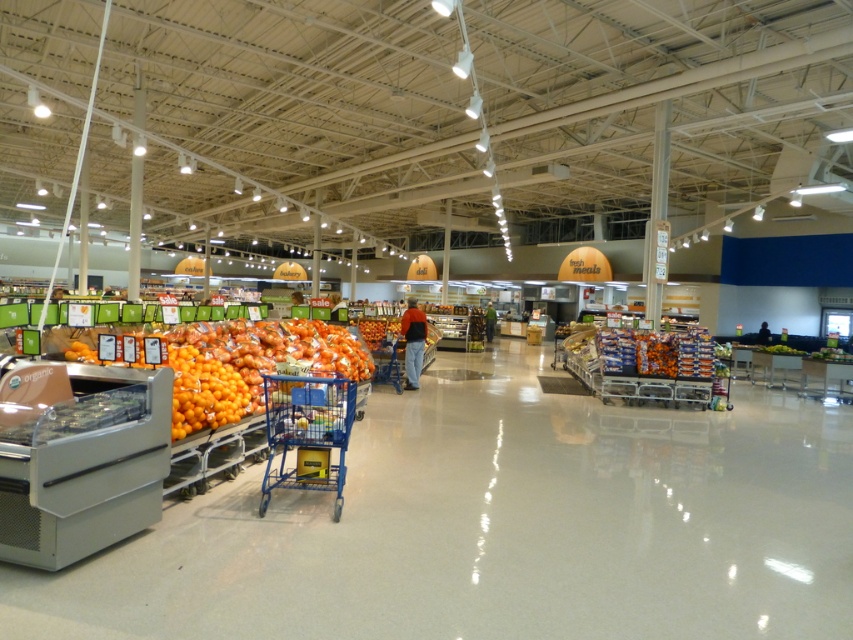
Question: Can you confirm if orange matte produce at left is smaller than blue plastic shopping cart at center?

Choices:
 (A) no
 (B) yes

Answer: (A)

Question: Which object is farther from the camera taking this photo?

Choices:
 (A) blue plastic shopping cart at center
 (B) orange matte produce at left

Answer: (A)

Question: Is orange matte produce at left thinner than blue plastic shopping cart at center?

Choices:
 (A) yes
 (B) no

Answer: (B)

Question: Which point is farther from the camera taking this photo?

Choices:
 (A) (306, 323)
 (B) (329, 387)

Answer: (A)

Question: Can you confirm if orange matte produce at left is positioned above blue plastic shopping cart at center?

Choices:
 (A) no
 (B) yes

Answer: (B)